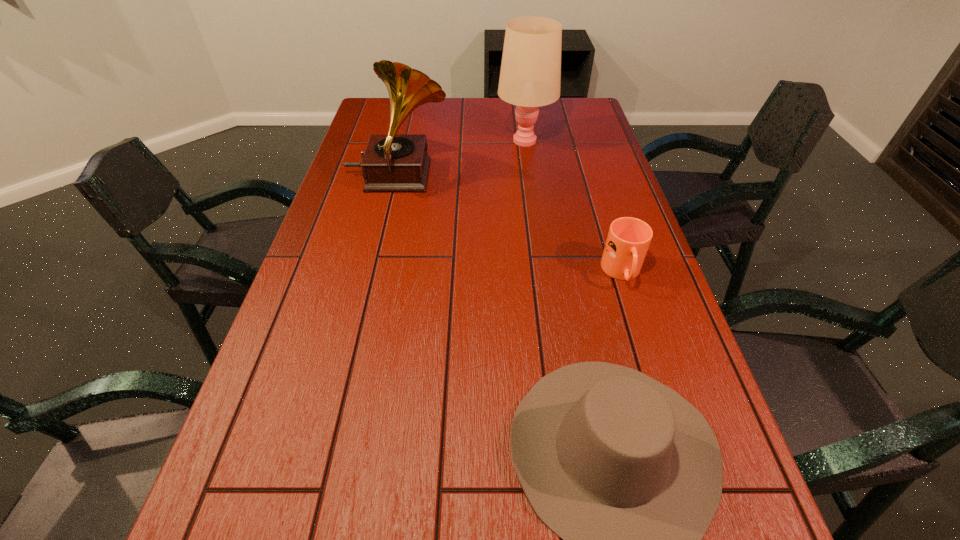
The image size is (960, 540). I want to click on lampshade, so click(x=530, y=76).

You are a GUI agent. You are given a task and a screenshot of the screen. Output one action in this format:
    pyautogui.click(x=<x>, y=<y>)
    Task: Click on the leftmost object
    The width and height of the screenshot is (960, 540).
    Given the screenshot: What is the action you would take?
    pyautogui.click(x=392, y=162)

Image resolution: width=960 pixels, height=540 pixels. In order to click on phonograph record in this screenshot , I will do `click(392, 162)`.

At what (x,y) coordinates should I click in order to perform the action: click on mug. Please return your answer as a coordinate pair (x, y). The width and height of the screenshot is (960, 540). Looking at the image, I should click on (628, 240).

The height and width of the screenshot is (540, 960). I want to click on vacant space located 0.220m on the front of the farthest object, so click(x=533, y=194).

The width and height of the screenshot is (960, 540). Find the location of `vacant space located 0.310m from the horn of the phonograph record`. vacant space located 0.310m from the horn of the phonograph record is located at coordinates (549, 177).

Where is `free location located on the handle side of the third farthest object`? This screenshot has width=960, height=540. free location located on the handle side of the third farthest object is located at coordinates (672, 433).

I want to click on object that is positioned at the far edge, so click(530, 76).

Image resolution: width=960 pixels, height=540 pixels. I want to click on object situated at the left edge, so click(392, 162).

Locate an element on the screen. The image size is (960, 540). object present at the right edge is located at coordinates (628, 240).